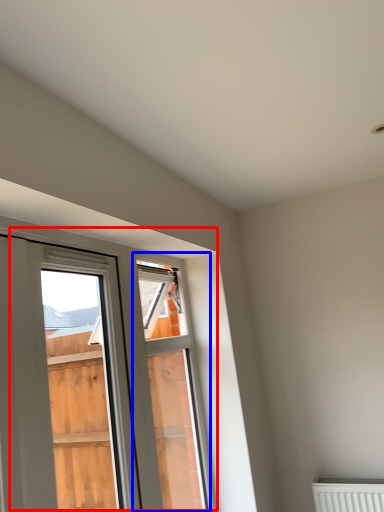
Question: Which object is closer to the camera taking this photo, window (highlighted by a red box) or window frame (highlighted by a blue box)?

Choices:
 (A) window
 (B) window frame

Answer: (A)